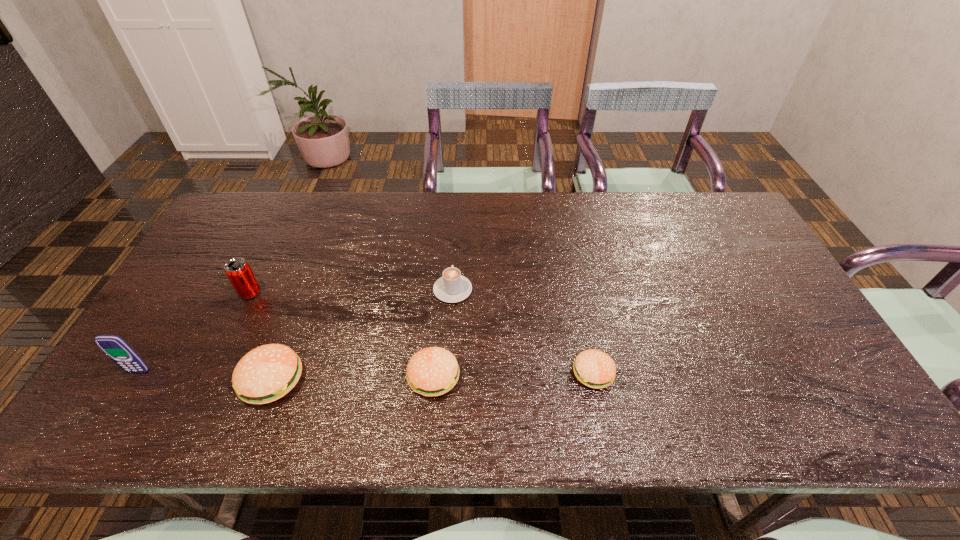
Where is `blank space at the far edge of the desktop`? blank space at the far edge of the desktop is located at coordinates (470, 235).

You are a GUI agent. You are given a task and a screenshot of the screen. Output one action in this format:
    pyautogui.click(x=<x>, y=<y>)
    Task: Click on the vacant space at the near edge of the desktop
    
    Given the screenshot: What is the action you would take?
    pyautogui.click(x=757, y=392)

The width and height of the screenshot is (960, 540). I want to click on free region at the left edge of the desktop, so click(161, 325).

In the image, there is a desktop. Identify the location of vacant space at the right edge. (760, 306).

Locate an element on the screen. This screenshot has height=540, width=960. free region at the near left corner of the desktop is located at coordinates (114, 390).

Identify the location of vacant space that's between the tallest patty and the second patty from left to right. The width and height of the screenshot is (960, 540). (353, 379).

Where is `vacant region between the second tallest patty and the third object from left to right`? This screenshot has width=960, height=540. vacant region between the second tallest patty and the third object from left to right is located at coordinates pyautogui.click(x=353, y=379).

At what (x,y) coordinates should I click in order to perform the action: click on vacant space that's between the shortest patty and the cappuccino. Please return your answer as a coordinate pair (x, y). The width and height of the screenshot is (960, 540). Looking at the image, I should click on (523, 332).

In order to click on free space between the second tallest object and the tallest patty in this screenshot , I will do `click(261, 336)`.

In order to click on vacant area that lies between the second tallest object and the rightmost patty in this screenshot , I will do (x=421, y=333).